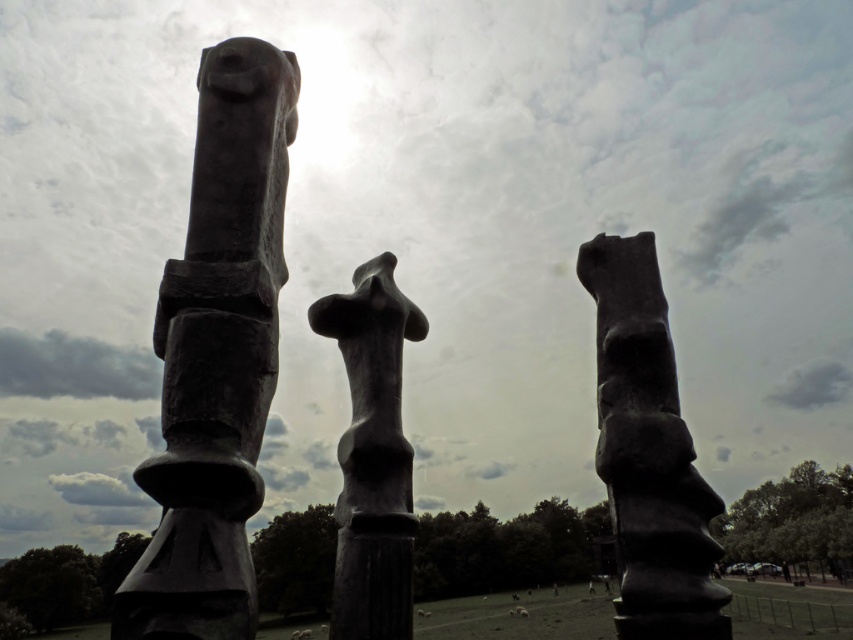
Question: Is matte black sculpture at left to the right of matte black totem pole at center from the viewer's perspective?

Choices:
 (A) yes
 (B) no

Answer: (B)

Question: Does matte black totem pole at center appear over matte black sculpture at center?

Choices:
 (A) no
 (B) yes

Answer: (B)

Question: Is matte black totem pole at center further to camera compared to matte black sculpture at center?

Choices:
 (A) no
 (B) yes

Answer: (A)

Question: Which of these objects is positioned closest to the matte black totem pole at center?

Choices:
 (A) matte black sculpture at center
 (B) matte black sculpture at left

Answer: (A)

Question: Among these points, which one is nearest to the camera?

Choices:
 (A) (691, 566)
 (B) (335, 512)
 (C) (173, 525)

Answer: (C)

Question: Estimate the real-world distances between objects in this image. Which object is farther from the matte black sculpture at left?

Choices:
 (A) matte black totem pole at center
 (B) matte black sculpture at center

Answer: (A)